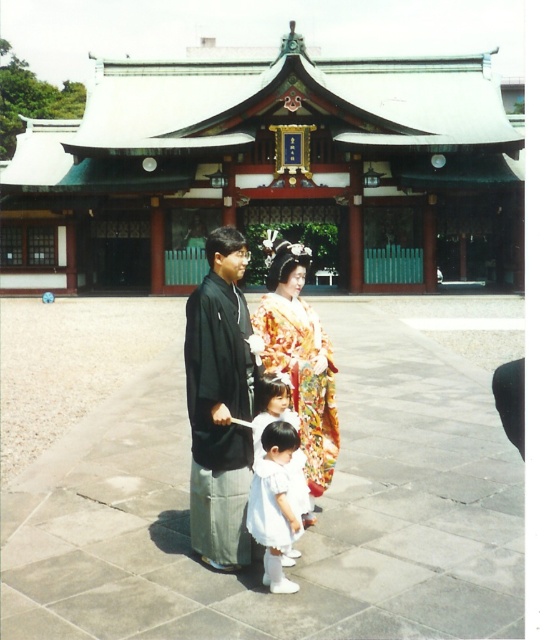
Does black matte kimono at center appear under silk kimono at center?

Yes, black matte kimono at center is below silk kimono at center.

Does point (213, 481) lie behind point (325, 378)?

No, (213, 481) is in front of (325, 378).

Where is `black matte kimono at center`? black matte kimono at center is located at coordinates (220, 403).

Is silk kimono at center to the right of white satin dress at lower center from the viewer's perspective?

Indeed, silk kimono at center is positioned on the right side of white satin dress at lower center.

Who is shorter, silk kimono at center or white satin dress at lower center?

Standing shorter between the two is white satin dress at lower center.

Where is `silk kimono at center`? silk kimono at center is located at coordinates (299, 355).

Where is `silk kimono at center`? silk kimono at center is located at coordinates (299, 355).

Who is more distant from viewer, (221, 420) or (284, 483)?

Positioned behind is point (221, 420).

Is point (214, 388) farther from camera compared to point (277, 524)?

Yes, point (214, 388) is behind point (277, 524).

Where is `black matte kimono at center`? This screenshot has height=640, width=545. black matte kimono at center is located at coordinates (220, 403).